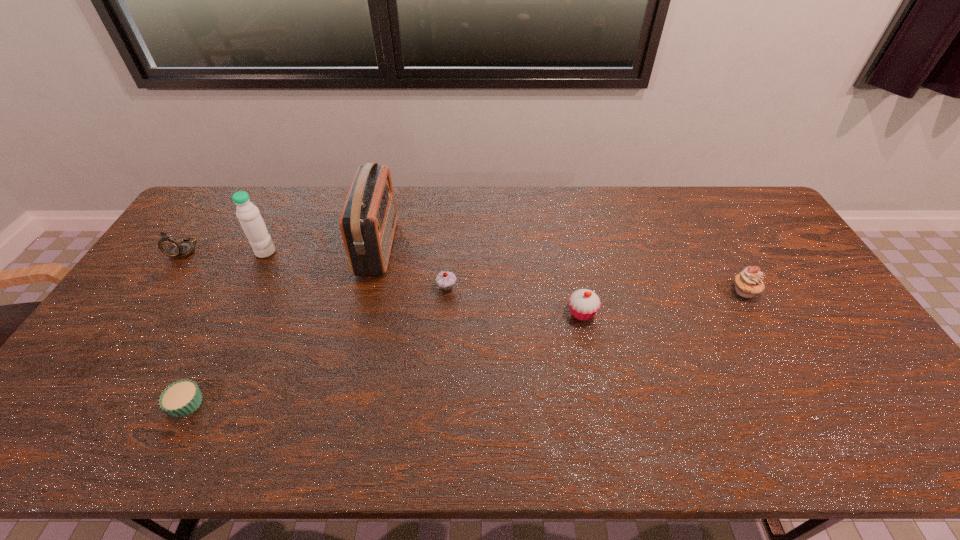
This screenshot has width=960, height=540. In order to click on radio receiver in this screenshot , I will do `click(368, 220)`.

The width and height of the screenshot is (960, 540). What are the coordinates of `the sixth shortest object` in the screenshot? It's located at (251, 221).

At what (x,y) coordinates should I click in order to perform the action: click on the leftmost object. Please return your answer as a coordinate pair (x, y). This screenshot has width=960, height=540. Looking at the image, I should click on (170, 246).

In order to click on the rightmost cupcake in this screenshot , I will do `click(748, 283)`.

The height and width of the screenshot is (540, 960). Identify the location of the fifth object from left to right. (445, 280).

You are a GUI agent. You are given a task and a screenshot of the screen. Output one action in this format:
    pyautogui.click(x=<x>, y=<y>)
    Task: Click on the sixth object from left to right
    This screenshot has height=540, width=960.
    Given the screenshot: What is the action you would take?
    pyautogui.click(x=584, y=304)

This screenshot has width=960, height=540. I want to click on the leftmost cupcake, so click(x=183, y=397).

Locate an element on the screen. The height and width of the screenshot is (540, 960). the shortest object is located at coordinates (183, 397).

Identify the location of vacant position located 0.300m on the front-facing side of the radio receiver. The width and height of the screenshot is (960, 540). (485, 247).

Locate an element on the screen. Image resolution: width=960 pixels, height=540 pixels. free space located 0.090m on the front of the second tallest object is located at coordinates (252, 279).